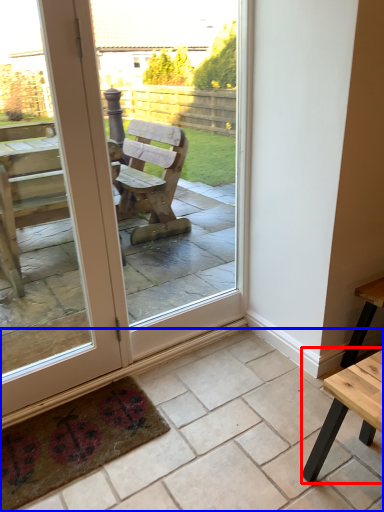
Question: Which object is closer to the camera taking this photo, table (highlighted by a red box) or tile (highlighted by a blue box)?

Choices:
 (A) table
 (B) tile

Answer: (B)